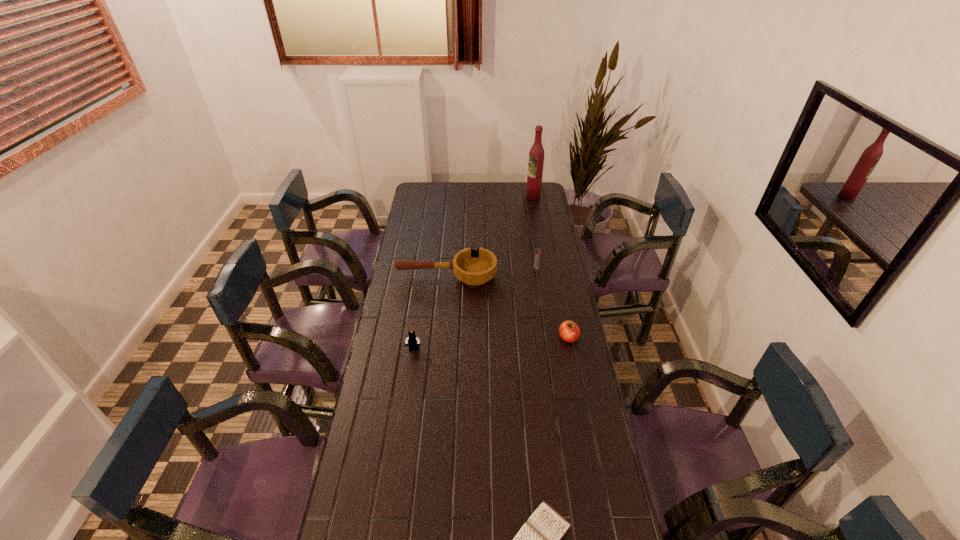
The height and width of the screenshot is (540, 960). I want to click on the farthest object, so click(536, 155).

Where is `liquor`? liquor is located at coordinates (x=536, y=155).

Where is `igniter`? This screenshot has width=960, height=540. igniter is located at coordinates (537, 252).

Where is `Lego`? Lego is located at coordinates (412, 341).

Where is `saucepan`? Image resolution: width=960 pixels, height=540 pixels. saucepan is located at coordinates (474, 267).

Where is `the fourth farthest object`? The width and height of the screenshot is (960, 540). the fourth farthest object is located at coordinates (569, 331).

What are the coordinates of `vacant region located 0.310m on the label of the liquor` in the screenshot? It's located at (472, 197).

Where is `vacant region located on the label of the liquor`? This screenshot has width=960, height=540. vacant region located on the label of the liquor is located at coordinates (516, 197).

Locate an element on the screen. vacant space located on the label of the liquor is located at coordinates (474, 197).

You are a GUI agent. You are given a task and a screenshot of the screen. Output one action in this format:
    pyautogui.click(x=<x>, y=<y>)
    Task: Click on the vacant space located on the left of the igniter
    
    Given the screenshot: What is the action you would take?
    [516, 268]